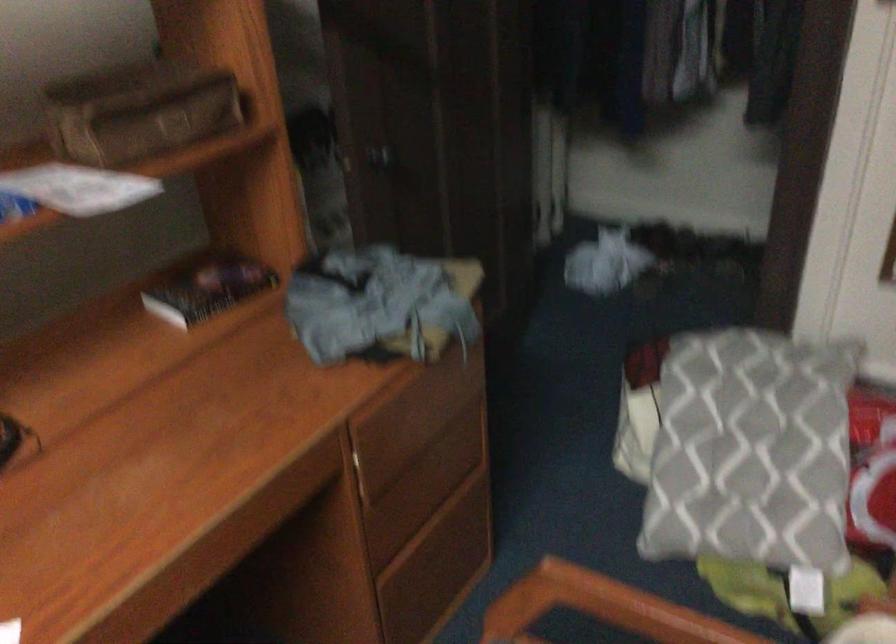
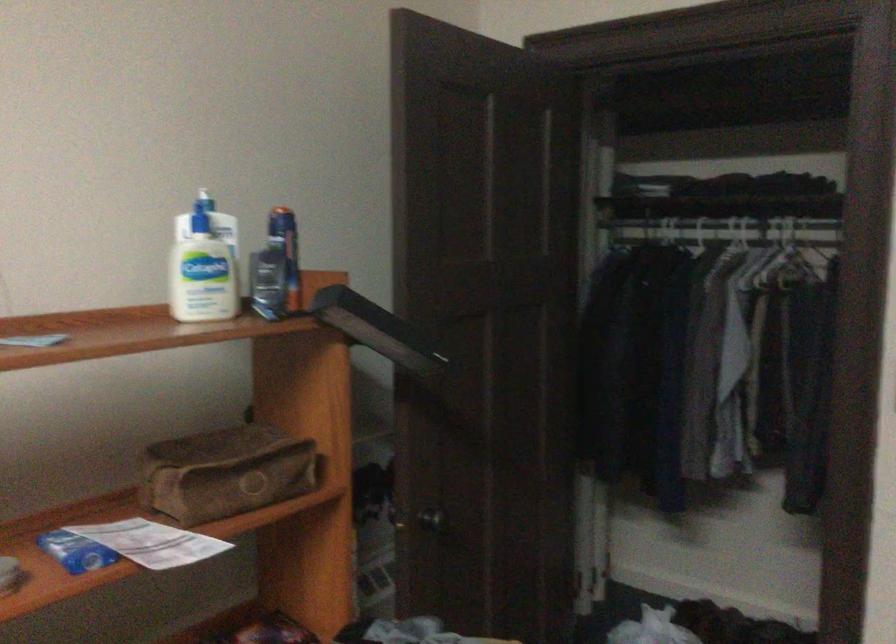
In the second image, find the point that corresponds to point 142,108 in the first image.

(226, 471)